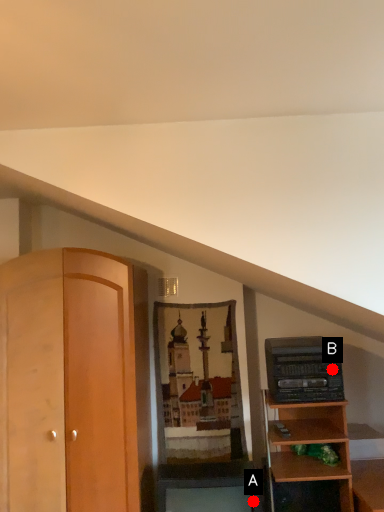
Question: Two points are circled on the image, labeled by A and B beside each circle. Which point is closer to the camera?

Choices:
 (A) A is closer
 (B) B is closer

Answer: (B)